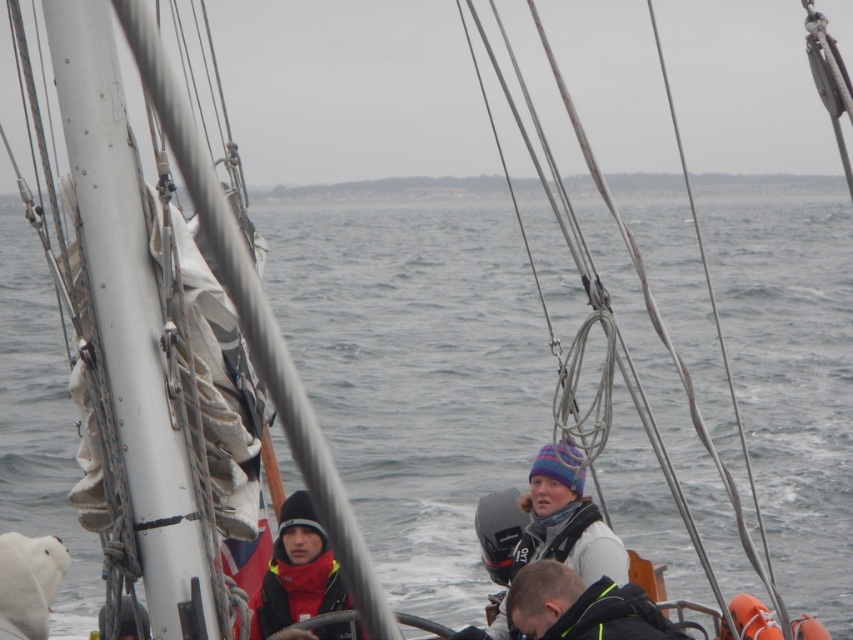
Is striped knit hat at center to the right of red fleece jacket at lower left from the viewer's perspective?

Indeed, striped knit hat at center is positioned on the right side of red fleece jacket at lower left.

Between point (556, 497) and point (306, 520), which one is positioned behind?

The point (556, 497) is more distant.

The image size is (853, 640). Identify the location of striped knit hat at center. (566, 518).

Is point (494, 627) closer to viewer compared to point (541, 589)?

No, (494, 627) is behind (541, 589).

Identify the location of striped knit hat at center. (566, 518).

You are a GUI agent. You are given a task and a screenshot of the screen. Output one action in this format:
    pyautogui.click(x=<x>, y=<y>)
    Task: Click on the striped knit hat at center
    
    Given the screenshot: What is the action you would take?
    pyautogui.click(x=566, y=518)

Who is taller, dark brown leather jacket at lower center or red fleece jacket at lower left?

red fleece jacket at lower left is taller.

Is dark brown leather jacket at lower center to the right of red fleece jacket at lower left from the viewer's perspective?

Yes, dark brown leather jacket at lower center is to the right of red fleece jacket at lower left.

Measure the distance between point (566, 600) and camera.

Point (566, 600) and camera are 23.55 feet apart from each other.

The image size is (853, 640). What are the coordinates of `dark brown leather jacket at lower center` in the screenshot? It's located at (581, 605).